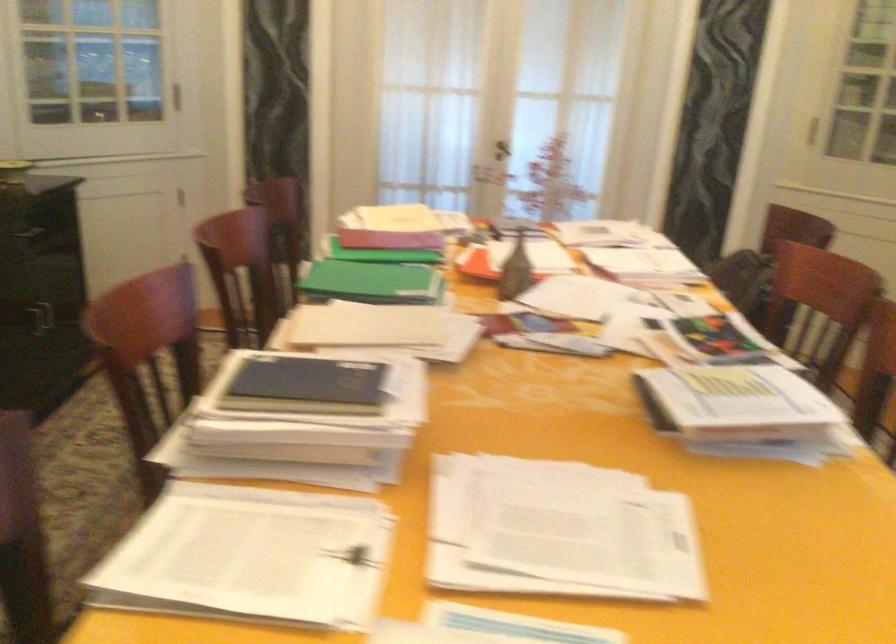
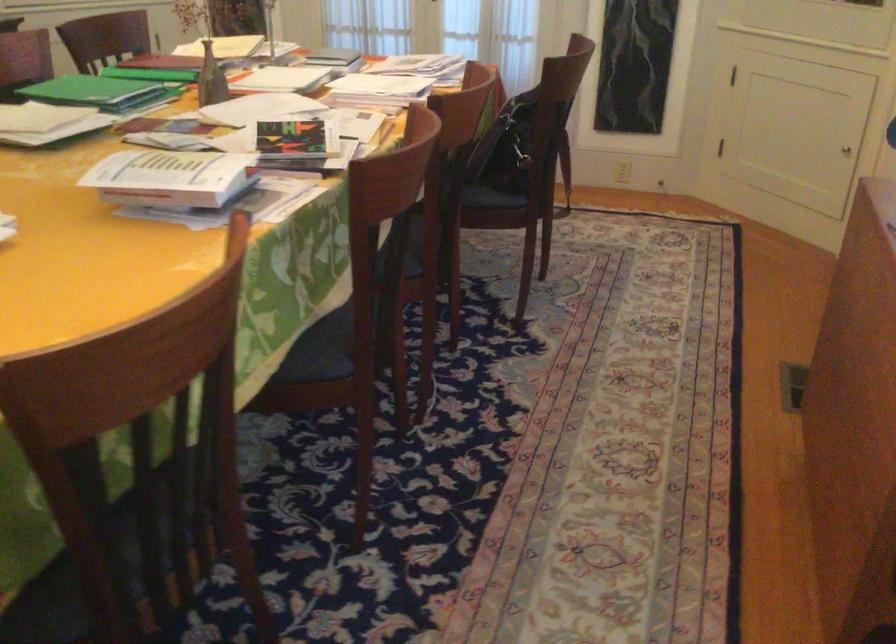
Where in the second image is the point corresponding to the point at 521,276 from the first image?

(211, 79)